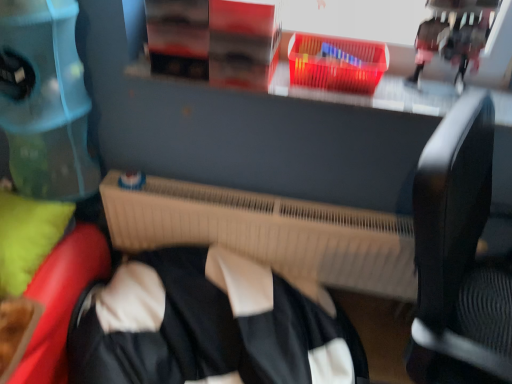
The height and width of the screenshot is (384, 512). In order to click on vacant region above beige plastic radiator at center (from a real-world perspective) in this screenshot , I will do `click(273, 207)`.